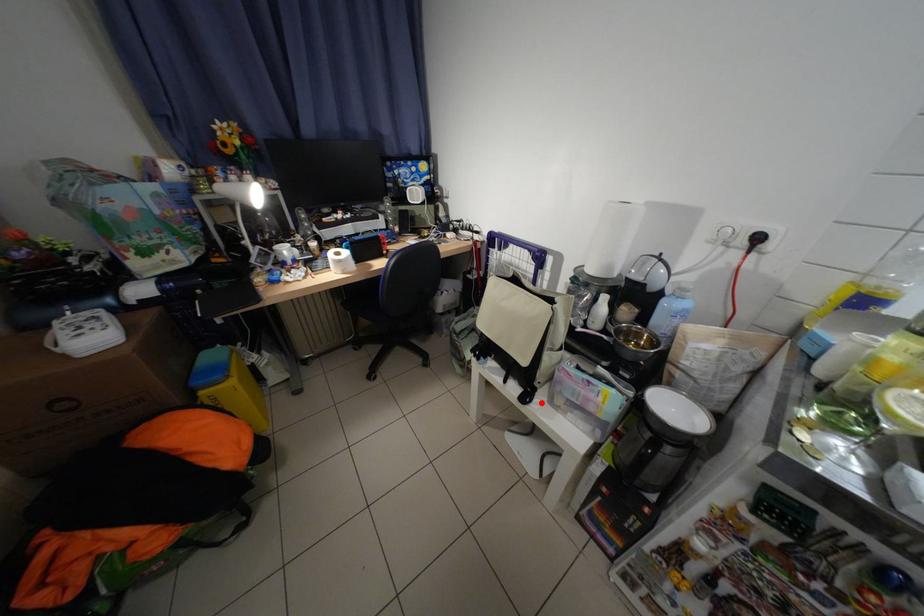
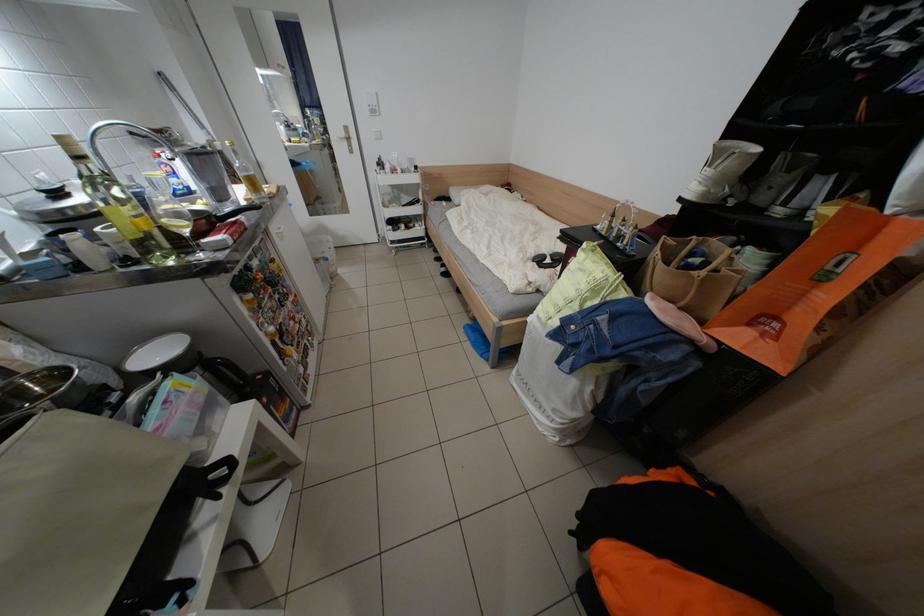
Question: I am providing you with two images of the same scene from different viewpoints. Image1 has a red point marked. In image2, the corresponding 3D location appears at what relative position? Reply with the corresponding letter.

Choices:
 (A) Closer
 (B) Farther

Answer: (A)